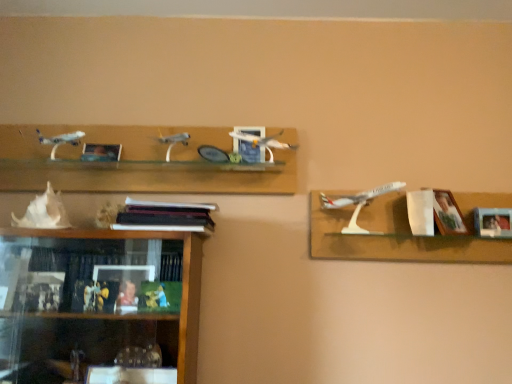
What do you see at coordinates (248, 151) in the screenshot? The image size is (512, 384). I see `matte blue picture frame at center, marked as the 2th picture frame in a left-to-right arrangement` at bounding box center [248, 151].

The height and width of the screenshot is (384, 512). Describe the element at coordinates (44, 212) in the screenshot. I see `white shell at lower left` at that location.

What do you see at coordinates (493, 222) in the screenshot?
I see `wooden photo frame at right, arranged as the 1th picture frame when viewed from the right` at bounding box center [493, 222].

This screenshot has height=384, width=512. Describe the element at coordinates (101, 152) in the screenshot. I see `matte wooden picture frame at upper center, the first picture frame from the left` at that location.

You are a GUI agent. You are given a task and a screenshot of the screen. Output one action in this format:
    pyautogui.click(x=<x>, y=<y>)
    Task: Click on the matte blue picture frame at center, the 3th picture frame in the right-to-left sequence
    This screenshot has height=384, width=512.
    Given the screenshot: What is the action you would take?
    pyautogui.click(x=248, y=151)

Visually, is wooden photo frame at right, arranged as the 1th picture frame when viewed from the right, positioned to the left or to the right of white plastic airplane at right?

From the image, it's evident that wooden photo frame at right, arranged as the 1th picture frame when viewed from the right, is to the right of white plastic airplane at right.

From a real-world perspective, is wooden photo frame at right, the fourth picture frame when ordered from left to right, physically above white plastic airplane at right?

Yes, from a real-world perspective, wooden photo frame at right, the fourth picture frame when ordered from left to right, is above white plastic airplane at right.

Is wooden photo frame at right, the fourth picture frame when ordered from left to right, behind white plastic airplane at right?

That is True.

Considering the sizes of objects wooden photo frame at right, the fourth picture frame when ordered from left to right, and white plastic airplane at right in the image provided, who is wider, wooden photo frame at right, the fourth picture frame when ordered from left to right, or white plastic airplane at right?

white plastic airplane at right.

Consider the image. Does white plastic airplane at right have a larger size compared to black matte bookshelf at center?

Yes.

How much distance is there between white plastic airplane at right and black matte bookshelf at center?

→ white plastic airplane at right and black matte bookshelf at center are 26.94 inches apart from each other.

Are white plastic airplane at right and black matte bookshelf at center located far from each other?

They are positioned close to each other.

From a real-world perspective, who is located lower, wooden picture frame at right, the 2th picture frame positioned from the right, or matte wooden picture frame at upper center, placed as the 4th picture frame when sorted from right to left?

wooden picture frame at right, the 2th picture frame positioned from the right, from a real-world perspective.

Which object is further away from the camera, wooden picture frame at right, the 2th picture frame positioned from the right, or matte wooden picture frame at upper center, placed as the 4th picture frame when sorted from right to left?

Positioned behind is matte wooden picture frame at upper center, placed as the 4th picture frame when sorted from right to left.

Measure the distance between wooden picture frame at right, placed as the 3th picture frame when sorted from left to right, and matte wooden picture frame at upper center, placed as the 4th picture frame when sorted from right to left.

wooden picture frame at right, placed as the 3th picture frame when sorted from left to right, and matte wooden picture frame at upper center, placed as the 4th picture frame when sorted from right to left, are 1.29 meters apart from each other.

Find the location of a particular element. picture frame that is the 1st object located above the wooden picture frame at right, the 2th picture frame positioned from the right (from the image's perspective) is located at coordinates (101, 152).

Considering the sizes of objects black matte bookshelf at center and white plastic airplane at right in the image provided, who is thinner, black matte bookshelf at center or white plastic airplane at right?

Thinner between the two is black matte bookshelf at center.

Between black matte bookshelf at center and white plastic airplane at right, which one has smaller size?

With smaller size is black matte bookshelf at center.

Would you consider black matte bookshelf at center to be distant from white plastic airplane at right?

No, black matte bookshelf at center is not far away from white plastic airplane at right.

Is black matte bookshelf at center oriented away from white plastic airplane at right?

No, black matte bookshelf at center is not facing the opposite direction of white plastic airplane at right.

Does point (207, 218) come farther from viewer compared to point (246, 133)?

No, it is in front of (246, 133).

From a real-world perspective, is black matte bookshelf at center positioned above or below matte blue picture frame at center, marked as the 2th picture frame in a left-to-right arrangement?

black matte bookshelf at center is below matte blue picture frame at center, marked as the 2th picture frame in a left-to-right arrangement.

From the picture: Is black matte bookshelf at center looking in the opposite direction of matte blue picture frame at center, marked as the 2th picture frame in a left-to-right arrangement?

No, matte blue picture frame at center, marked as the 2th picture frame in a left-to-right arrangement, is not at the back of black matte bookshelf at center.

Is black matte bookshelf at center far away from matte blue picture frame at center, marked as the 2th picture frame in a left-to-right arrangement?

Actually, black matte bookshelf at center and matte blue picture frame at center, marked as the 2th picture frame in a left-to-right arrangement, are a little close together.

Is wooden picture frame at right, placed as the 3th picture frame when sorted from left to right, thinner than white shell at lower left?

Yes, wooden picture frame at right, placed as the 3th picture frame when sorted from left to right, is thinner than white shell at lower left.

This screenshot has height=384, width=512. I want to click on toy below the wooden picture frame at right, placed as the 3th picture frame when sorted from left to right (from a real-world perspective), so click(44, 212).

How many degrees apart are the facing directions of wooden picture frame at right, placed as the 3th picture frame when sorted from left to right, and white shell at lower left?

They differ by 24.2 degrees in their facing directions.

Does wooden photo frame at right, the fourth picture frame when ordered from left to right, touch wooden picture frame at right, the 2th picture frame positioned from the right?

No, wooden photo frame at right, the fourth picture frame when ordered from left to right, is not next to wooden picture frame at right, the 2th picture frame positioned from the right.

From a real-world perspective, is wooden photo frame at right, the fourth picture frame when ordered from left to right, positioned above or below wooden picture frame at right, the 2th picture frame positioned from the right?

In terms of real-world spatial position, wooden photo frame at right, the fourth picture frame when ordered from left to right, is below wooden picture frame at right, the 2th picture frame positioned from the right.

Between wooden photo frame at right, arranged as the 1th picture frame when viewed from the right, and wooden picture frame at right, the 2th picture frame positioned from the right, which one has smaller size?

wooden picture frame at right, the 2th picture frame positioned from the right, is smaller.

Identify the location of picture frame that is below the wooden picture frame at right, placed as the 3th picture frame when sorted from left to right (from the image's perspective). (493, 222).

Starting from the white plastic airplane at right, which picture frame is the 2nd one to the right? Please provide its 2D coordinates.

[(493, 222)]

You are a GUI agent. You are given a task and a screenshot of the screen. Output one action in this format:
    pyautogui.click(x=<x>, y=<y>)
    Task: Click on the book below the white plastic airplane at right (from a real-world perspective)
    The width and height of the screenshot is (512, 384).
    Given the screenshot: What is the action you would take?
    point(165,216)

Looking at the image, which one is located closer to wooden photo frame at right, arranged as the 1th picture frame when viewed from the right, matte blue picture frame at center, the 3th picture frame in the right-to-left sequence, or wooden picture frame at right, the 2th picture frame positioned from the right?

The object closer to wooden photo frame at right, arranged as the 1th picture frame when viewed from the right, is wooden picture frame at right, the 2th picture frame positioned from the right.

Looking at the image, which one is located further to wooden picture frame at right, placed as the 3th picture frame when sorted from left to right, black matte bookshelf at center or matte blue picture frame at center, marked as the 2th picture frame in a left-to-right arrangement?

black matte bookshelf at center lies further to wooden picture frame at right, placed as the 3th picture frame when sorted from left to right, than the other object.

From the image, which object appears to be farther from white plastic airplane at right, matte wooden picture frame at upper center, placed as the 4th picture frame when sorted from right to left, or wooden picture frame at right, the 2th picture frame positioned from the right?

matte wooden picture frame at upper center, placed as the 4th picture frame when sorted from right to left, is further to white plastic airplane at right.

Looking at the image, which one is located further to wooden picture frame at right, the 2th picture frame positioned from the right, white plastic airplane at right or matte blue picture frame at center, marked as the 2th picture frame in a left-to-right arrangement?

matte blue picture frame at center, marked as the 2th picture frame in a left-to-right arrangement, lies further to wooden picture frame at right, the 2th picture frame positioned from the right, than the other object.

Considering their positions, is matte wooden picture frame at upper center, placed as the 4th picture frame when sorted from right to left, positioned closer to wooden picture frame at right, placed as the 3th picture frame when sorted from left to right, than wooden photo frame at right, arranged as the 1th picture frame when viewed from the right?

Based on the image, wooden photo frame at right, arranged as the 1th picture frame when viewed from the right, appears to be nearer to wooden picture frame at right, placed as the 3th picture frame when sorted from left to right.

Based on their spatial positions, is wooden photo frame at right, the fourth picture frame when ordered from left to right, or matte wooden picture frame at upper center, the first picture frame from the left, further from white plastic airplane at right?

matte wooden picture frame at upper center, the first picture frame from the left, is further to white plastic airplane at right.

Which object lies further to the anchor point matte blue picture frame at center, marked as the 2th picture frame in a left-to-right arrangement, wooden picture frame at right, the 2th picture frame positioned from the right, or matte wooden picture frame at upper center, placed as the 4th picture frame when sorted from right to left?

wooden picture frame at right, the 2th picture frame positioned from the right, is further to matte blue picture frame at center, marked as the 2th picture frame in a left-to-right arrangement.

When comparing their distances from matte blue picture frame at center, the 3th picture frame in the right-to-left sequence, does wooden picture frame at right, the 2th picture frame positioned from the right, or white plastic airplane at right seem further?

Based on the image, wooden picture frame at right, the 2th picture frame positioned from the right, appears to be further to matte blue picture frame at center, the 3th picture frame in the right-to-left sequence.

Where is `shelf situated between matte wooden picture frame at upper center, the first picture frame from the left, and wooden photo frame at right, the fourth picture frame when ordered from left to right, from left to right`? shelf situated between matte wooden picture frame at upper center, the first picture frame from the left, and wooden photo frame at right, the fourth picture frame when ordered from left to right, from left to right is located at coordinates (403, 232).

The width and height of the screenshot is (512, 384). Identify the location of shelf between matte wooden picture frame at upper center, the first picture frame from the left, and wooden picture frame at right, placed as the 3th picture frame when sorted from left to right, in the horizontal direction. point(403,232).

Where is `picture frame situated between matte wooden picture frame at upper center, the first picture frame from the left, and wooden picture frame at right, the 2th picture frame positioned from the right, from left to right`? This screenshot has width=512, height=384. picture frame situated between matte wooden picture frame at upper center, the first picture frame from the left, and wooden picture frame at right, the 2th picture frame positioned from the right, from left to right is located at coordinates (248, 151).

Identify the location of book situated between matte wooden picture frame at upper center, placed as the 4th picture frame when sorted from right to left, and wooden photo frame at right, arranged as the 1th picture frame when viewed from the right, from left to right. coord(165,216).